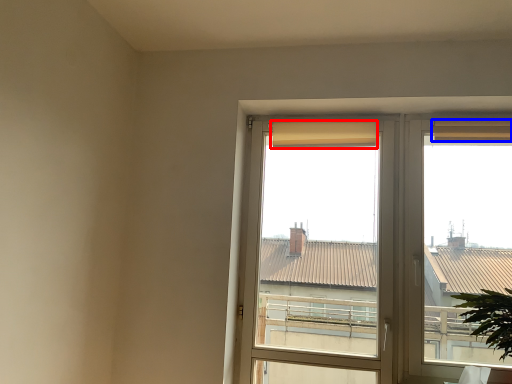
Question: Among these objects, which one is farthest to the camera, curtain (highlighted by a red box) or curtain (highlighted by a blue box)?

Choices:
 (A) curtain
 (B) curtain

Answer: (A)